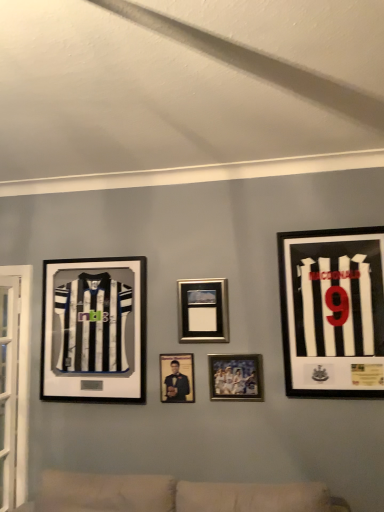
Question: Is matte black photo frame at center, the fourth picture frame when ordered from right to left, to the left of black matte jersey at right, acting as the fifth picture frame starting from the left, from the viewer's perspective?

Choices:
 (A) no
 (B) yes

Answer: (B)

Question: Does matte black photo frame at center, the fourth picture frame when ordered from right to left, contain black matte jersey at right, acting as the fifth picture frame starting from the left?

Choices:
 (A) no
 (B) yes

Answer: (A)

Question: From a real-world perspective, does matte black photo frame at center, the second picture frame viewed from the left, sit lower than black matte jersey at right, the 1th picture frame from the right?

Choices:
 (A) no
 (B) yes

Answer: (B)

Question: Can you confirm if matte black photo frame at center, the fourth picture frame when ordered from right to left, is shorter than black matte jersey at right, acting as the fifth picture frame starting from the left?

Choices:
 (A) no
 (B) yes

Answer: (B)

Question: Is matte black photo frame at center, the fourth picture frame when ordered from right to left, bigger than black matte jersey at right, the 1th picture frame from the right?

Choices:
 (A) yes
 (B) no

Answer: (B)

Question: Considering the relative sizes of matte black photo frame at center, the second picture frame viewed from the left, and black matte jersey at right, the 1th picture frame from the right, in the image provided, is matte black photo frame at center, the second picture frame viewed from the left, smaller than black matte jersey at right, the 1th picture frame from the right,?

Choices:
 (A) no
 (B) yes

Answer: (B)

Question: From a real-world perspective, is black matte jersey at right, acting as the fifth picture frame starting from the left, located beneath metallic silver photo frame at center, marked as the second picture frame in a right-to-left arrangement?

Choices:
 (A) no
 (B) yes

Answer: (A)

Question: Is black matte jersey at right, the 1th picture frame from the right, completely or partially outside of metallic silver photo frame at center, marked as the second picture frame in a right-to-left arrangement?

Choices:
 (A) yes
 (B) no

Answer: (A)

Question: Does black matte jersey at right, the 1th picture frame from the right, appear on the left side of metallic silver photo frame at center, the 4th picture frame viewed from the left?

Choices:
 (A) no
 (B) yes

Answer: (A)

Question: Is metallic silver photo frame at center, marked as the second picture frame in a right-to-left arrangement, surrounded by black matte jersey at right, acting as the fifth picture frame starting from the left?

Choices:
 (A) no
 (B) yes

Answer: (A)

Question: Does black matte jersey at right, the 1th picture frame from the right, come in front of metallic silver photo frame at center, the 4th picture frame viewed from the left?

Choices:
 (A) no
 (B) yes

Answer: (B)

Question: Does black matte jersey at right, acting as the fifth picture frame starting from the left, have a greater height compared to metallic silver photo frame at center, the 4th picture frame viewed from the left?

Choices:
 (A) no
 (B) yes

Answer: (B)

Question: Could you tell me if black matte jersey at left, the 1th picture frame positioned from the left, is facing matte black photo frame at center, the second picture frame viewed from the left?

Choices:
 (A) no
 (B) yes

Answer: (A)